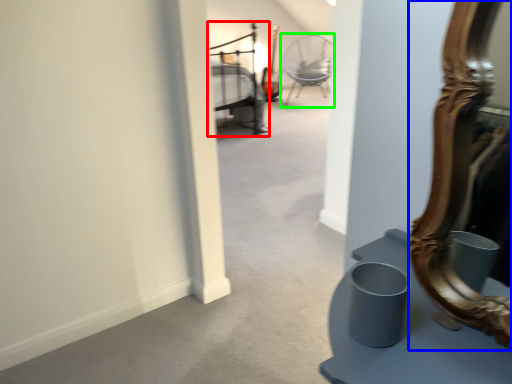
Question: Estimate the real-world distances between objects in this image. Which object is closer to bed (highlighted by a red box), mirror (highlighted by a blue box) or chair (highlighted by a green box)?

Choices:
 (A) mirror
 (B) chair

Answer: (B)